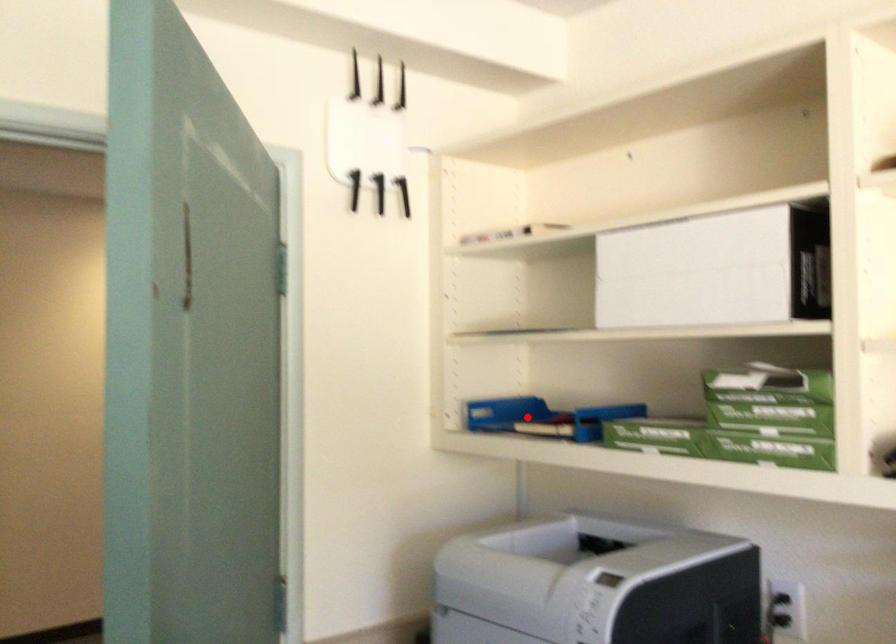
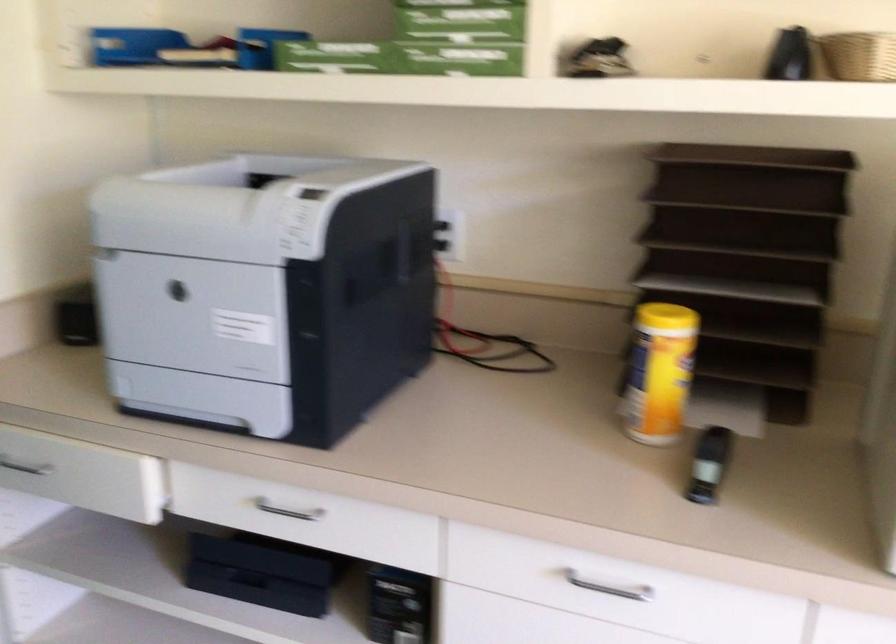
Question: I am providing you with two images of the same scene from different viewpoints. Image1 has a red point marked. In image2, the corresponding 3D location appears at what relative position? Reply with the corresponding letter.

Choices:
 (A) Closer
 (B) Farther

Answer: (A)